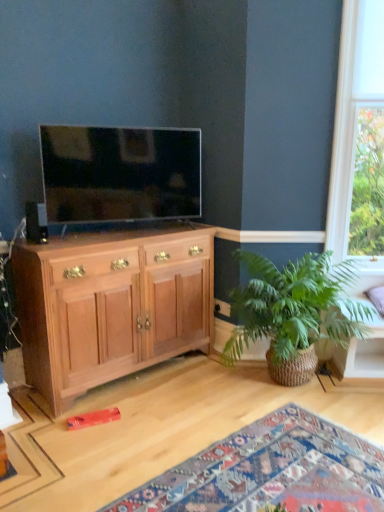
Identify the location of vacant space underneath green woven basket at right (from a real-world perspective). Image resolution: width=384 pixels, height=512 pixels. (276, 390).